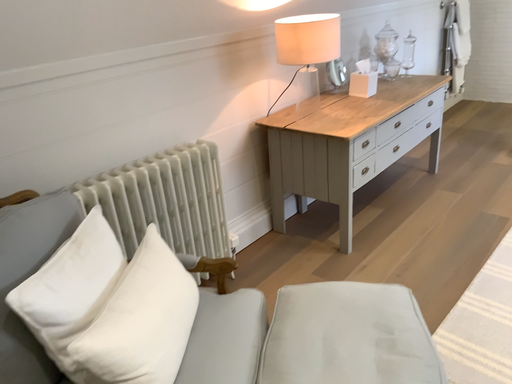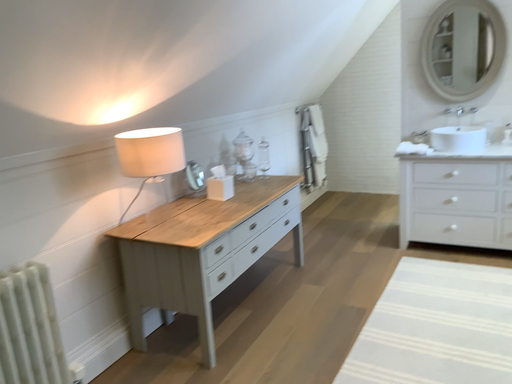
Question: Which way did the camera rotate in the video?

Choices:
 (A) rotated downward
 (B) rotated upward

Answer: (B)